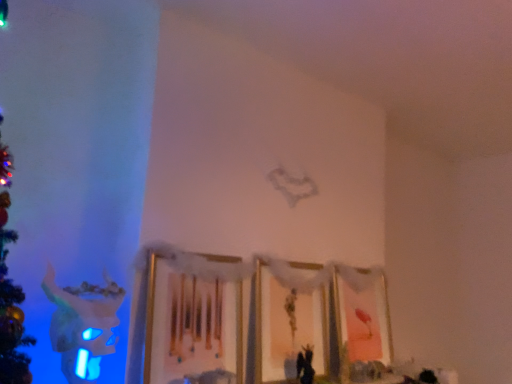
Question: Can matte gold picture frame at center, the 2th picture frame when ordered from right to left, be found inside wooden picture frame at center, which is counted as the third picture frame, starting from the right?

Choices:
 (A) no
 (B) yes

Answer: (A)

Question: Is wooden picture frame at center, which is counted as the third picture frame, starting from the right, thinner than matte gold picture frame at center, the 2th picture frame when ordered from right to left?

Choices:
 (A) yes
 (B) no

Answer: (A)

Question: Can you confirm if wooden picture frame at center, placed as the first picture frame when sorted from left to right, is positioned to the right of matte gold picture frame at center, placed as the second picture frame when sorted from left to right?

Choices:
 (A) yes
 (B) no

Answer: (B)

Question: From the image's perspective, is wooden picture frame at center, which is counted as the third picture frame, starting from the right, beneath matte gold picture frame at center, the 2th picture frame when ordered from right to left?

Choices:
 (A) no
 (B) yes

Answer: (A)

Question: From a real-world perspective, is wooden picture frame at center, placed as the first picture frame when sorted from left to right, on top of matte gold picture frame at center, placed as the second picture frame when sorted from left to right?

Choices:
 (A) yes
 (B) no

Answer: (A)

Question: From the image's perspective, is wooden picture frame at center, which is counted as the third picture frame, starting from the right, on top of matte gold picture frame at center, the 2th picture frame when ordered from right to left?

Choices:
 (A) yes
 (B) no

Answer: (A)

Question: Is matte gold picture frame at center, the 2th picture frame when ordered from right to left, surrounded by pink matte picture frame at lower right, the third picture frame from the left?

Choices:
 (A) yes
 (B) no

Answer: (B)

Question: Does pink matte picture frame at lower right, acting as the first picture frame starting from the right, come in front of matte gold picture frame at center, the 2th picture frame when ordered from right to left?

Choices:
 (A) no
 (B) yes

Answer: (A)

Question: Is pink matte picture frame at lower right, acting as the first picture frame starting from the right, at the right side of matte gold picture frame at center, placed as the second picture frame when sorted from left to right?

Choices:
 (A) yes
 (B) no

Answer: (A)

Question: Considering the relative sizes of pink matte picture frame at lower right, acting as the first picture frame starting from the right, and matte gold picture frame at center, the 2th picture frame when ordered from right to left, in the image provided, is pink matte picture frame at lower right, acting as the first picture frame starting from the right, smaller than matte gold picture frame at center, the 2th picture frame when ordered from right to left,?

Choices:
 (A) yes
 (B) no

Answer: (B)

Question: From the image's perspective, would you say pink matte picture frame at lower right, acting as the first picture frame starting from the right, is shown under matte gold picture frame at center, the 2th picture frame when ordered from right to left?

Choices:
 (A) yes
 (B) no

Answer: (A)

Question: From a real-world perspective, is pink matte picture frame at lower right, the third picture frame from the left, located beneath matte gold picture frame at center, the 2th picture frame when ordered from right to left?

Choices:
 (A) yes
 (B) no

Answer: (A)

Question: Is pink matte picture frame at lower right, acting as the first picture frame starting from the right, directly adjacent to wooden picture frame at center, placed as the first picture frame when sorted from left to right?

Choices:
 (A) no
 (B) yes

Answer: (A)